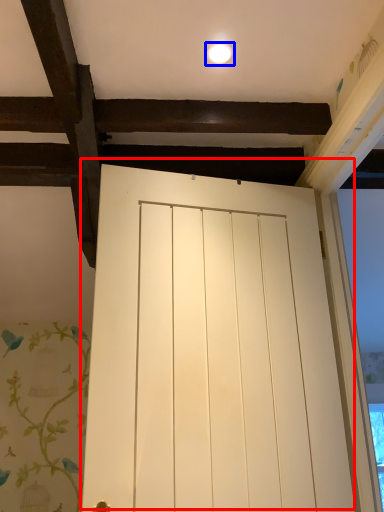
Question: Which object is closer to the camera taking this photo, door (highlighted by a red box) or lighting (highlighted by a blue box)?

Choices:
 (A) door
 (B) lighting

Answer: (A)